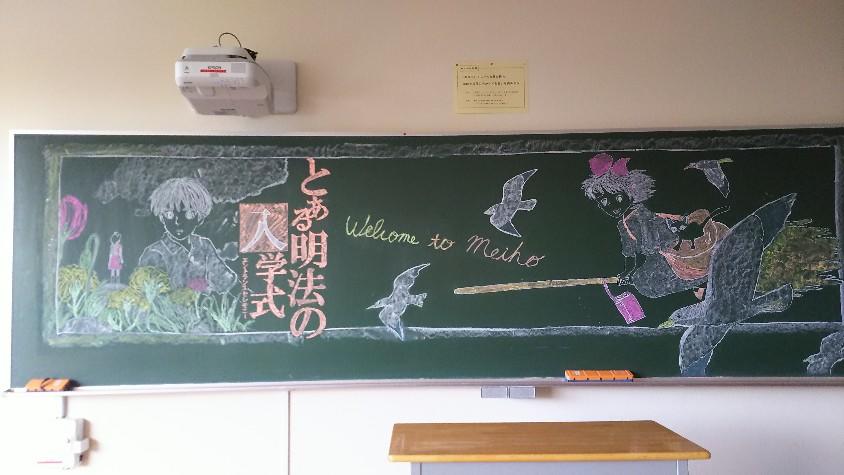
Locate an element on the screen. classroom is located at coordinates (387, 33).